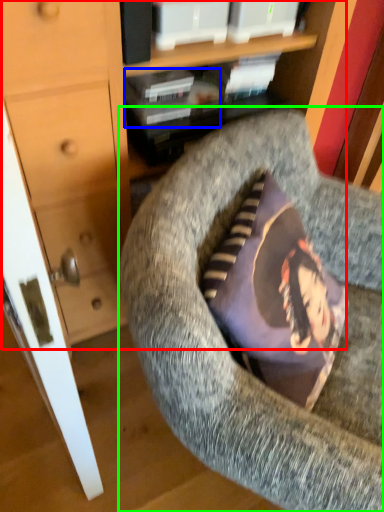
Question: Which object is positioned closest to dresser (highlighted by a red box)? Select from book (highlighted by a blue box) and chair (highlighted by a green box).

Choices:
 (A) book
 (B) chair

Answer: (A)